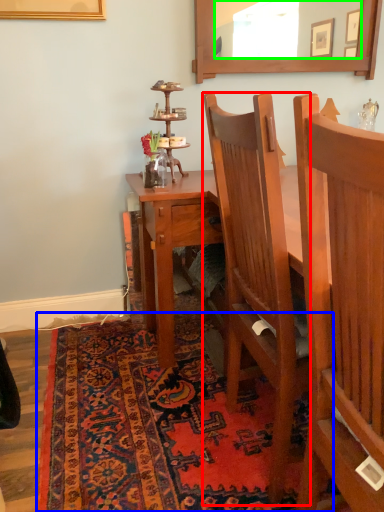
Question: Which object is positioned farthest from chair (highlighted by a red box)? Select from mat (highlighted by a blue box) and mirror (highlighted by a green box).

Choices:
 (A) mat
 (B) mirror

Answer: (B)